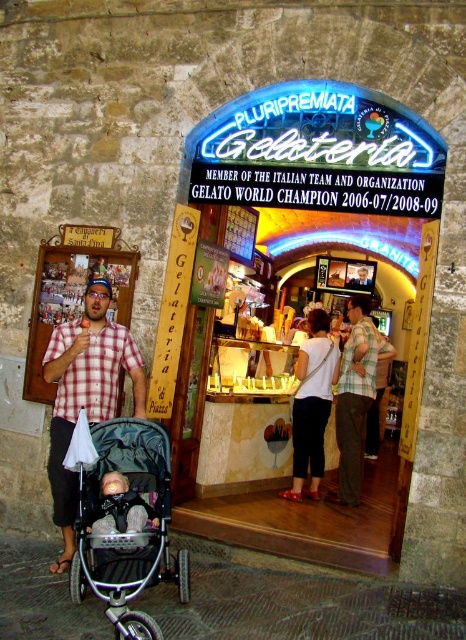
Question: Which of the following is the farthest from the observer?

Choices:
 (A) (118, 637)
 (B) (323, 458)
 (C) (356, 476)
 (D) (123, 525)

Answer: (B)

Question: Does silver metallic stroller at lower left have a greater width compared to soft beige fabric baby carriage at lower left?

Choices:
 (A) no
 (B) yes

Answer: (A)

Question: Can you confirm if plaid shirt at center is wider than matte white blouse at center?

Choices:
 (A) yes
 (B) no

Answer: (A)

Question: Which object appears closest to the camera in this image?

Choices:
 (A) soft beige fabric baby carriage at lower left
 (B) matte white blouse at center
 (C) plaid shirt at center
 (D) silver metallic stroller at lower left

Answer: (D)

Question: Estimate the real-world distances between objects in this image. Which object is closer to the soft beige fabric baby carriage at lower left?

Choices:
 (A) plaid shirt at center
 (B) matte white blouse at center
 (C) checkered fabric shirt at left

Answer: (C)

Question: Considering the relative positions of matte white blouse at center and soft beige fabric baby carriage at lower left in the image provided, where is matte white blouse at center located with respect to soft beige fabric baby carriage at lower left?

Choices:
 (A) below
 (B) above

Answer: (B)